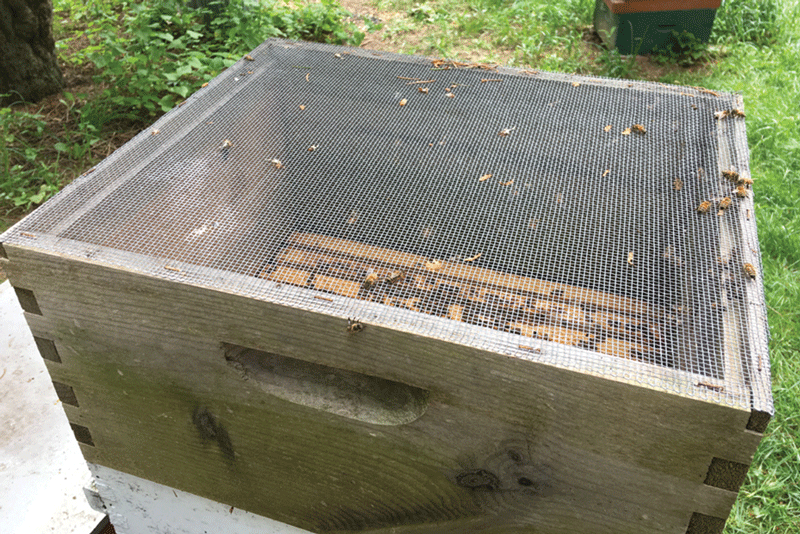
Locate an element on the screen. The height and width of the screenshot is (534, 800). handle is located at coordinates (370, 394).